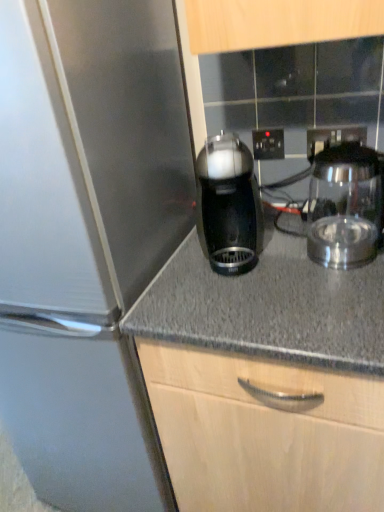
Question: Is black plastic electric outlet at center, the second electric outlet positioned from the front, positioned before black plastic electric outlet at upper center, which is the first electric outlet from right to left?

Choices:
 (A) yes
 (B) no

Answer: (B)

Question: From the image's perspective, does black plastic electric outlet at center, the second electric outlet positioned from the front, appear higher than black plastic electric outlet at upper center, which is the 1th electric outlet in front-to-back order?

Choices:
 (A) yes
 (B) no

Answer: (A)

Question: Does black plastic electric outlet at center, which ranks as the 1th electric outlet in left-to-right order, have a lesser height compared to black plastic electric outlet at upper center, which appears as the second electric outlet when viewed from the back?

Choices:
 (A) yes
 (B) no

Answer: (B)

Question: Is black plastic electric outlet at center, which appears as the second electric outlet when viewed from the right, turned away from black plastic electric outlet at upper center, which is the first electric outlet from right to left?

Choices:
 (A) no
 (B) yes

Answer: (A)

Question: Considering the relative positions of black plastic electric outlet at center, which appears as the second electric outlet when viewed from the right, and black plastic electric outlet at upper center, which is the first electric outlet from right to left, in the image provided, is black plastic electric outlet at center, which appears as the second electric outlet when viewed from the right, to the right of black plastic electric outlet at upper center, which is the first electric outlet from right to left, from the viewer's perspective?

Choices:
 (A) yes
 (B) no

Answer: (B)

Question: From a real-world perspective, relative to black plastic coffee maker at center, which appears as the second kitchen appliance when viewed from the right, is black plastic electric outlet at upper center, which is the first electric outlet from right to left, vertically above or below?

Choices:
 (A) above
 (B) below

Answer: (A)

Question: Looking at the image, does black plastic electric outlet at upper center, which is the 1th electric outlet in front-to-back order, seem bigger or smaller compared to black plastic coffee maker at center, which appears as the second kitchen appliance when viewed from the right?

Choices:
 (A) small
 (B) big

Answer: (A)

Question: From their relative heights in the image, would you say black plastic electric outlet at upper center, which is the first electric outlet from right to left, is taller or shorter than black plastic coffee maker at center, which appears as the second kitchen appliance when viewed from the right?

Choices:
 (A) tall
 (B) short

Answer: (B)

Question: In the image, is black plastic electric outlet at upper center, which is the first electric outlet from right to left, on the left side or the right side of black plastic coffee maker at center, which appears as the second kitchen appliance when viewed from the right?

Choices:
 (A) left
 (B) right

Answer: (B)

Question: From the image's perspective, is black plastic coffee maker at center, acting as the first kitchen appliance starting from the left, positioned above or below transparent glass carafe at right, the 2th kitchen appliance in the left-to-right sequence?

Choices:
 (A) above
 (B) below

Answer: (B)

Question: Considering the positions of black plastic coffee maker at center, acting as the first kitchen appliance starting from the left, and transparent glass carafe at right, the first kitchen appliance from the right, in the image, is black plastic coffee maker at center, acting as the first kitchen appliance starting from the left, taller or shorter than transparent glass carafe at right, the first kitchen appliance from the right,?

Choices:
 (A) tall
 (B) short

Answer: (A)

Question: Which is correct: black plastic coffee maker at center, acting as the first kitchen appliance starting from the left, is inside transparent glass carafe at right, the first kitchen appliance from the right, or outside of it?

Choices:
 (A) outside
 (B) inside

Answer: (A)

Question: In terms of size, does black plastic coffee maker at center, acting as the first kitchen appliance starting from the left, appear bigger or smaller than transparent glass carafe at right, the first kitchen appliance from the right?

Choices:
 (A) big
 (B) small

Answer: (B)

Question: Is black plastic coffee maker at center, acting as the first kitchen appliance starting from the left, taller or shorter than black plastic electric outlet at center, which is the 1th electric outlet in back-to-front order?

Choices:
 (A) short
 (B) tall

Answer: (B)

Question: Looking at the image, does black plastic coffee maker at center, which appears as the second kitchen appliance when viewed from the right, seem bigger or smaller compared to black plastic electric outlet at center, which ranks as the 1th electric outlet in left-to-right order?

Choices:
 (A) big
 (B) small

Answer: (A)